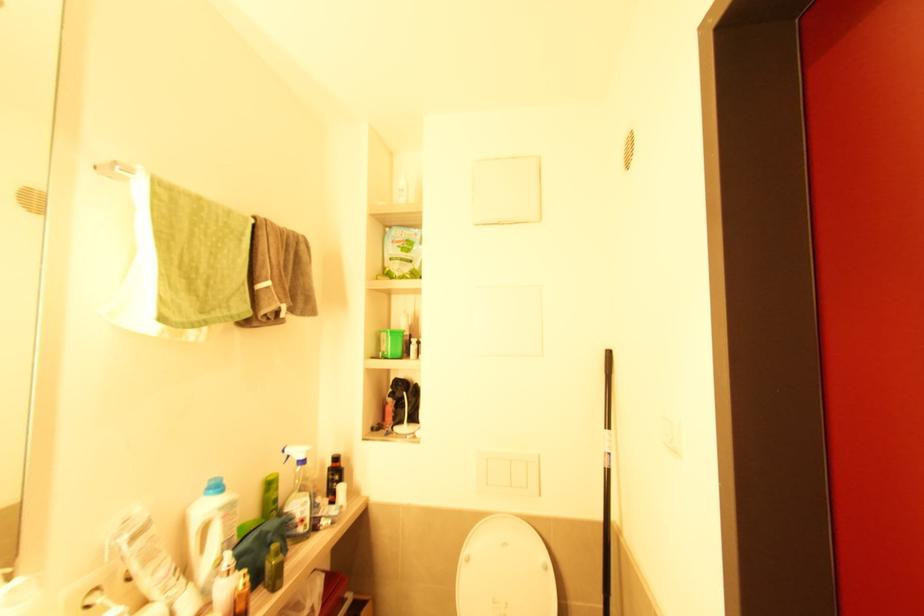
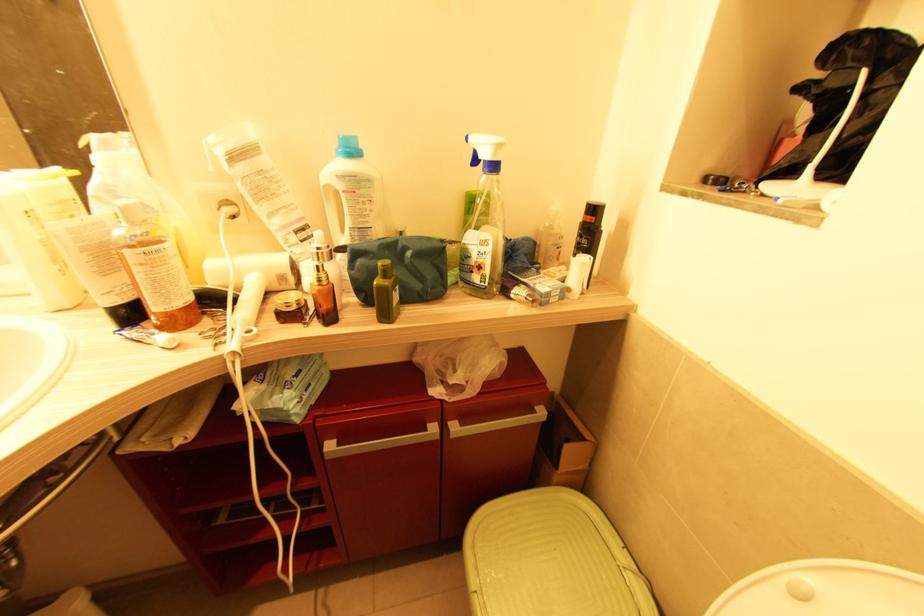
Based on the photo, first-person continuous shooting, in which direction is the camera rotating?

The camera rotated toward left-down.